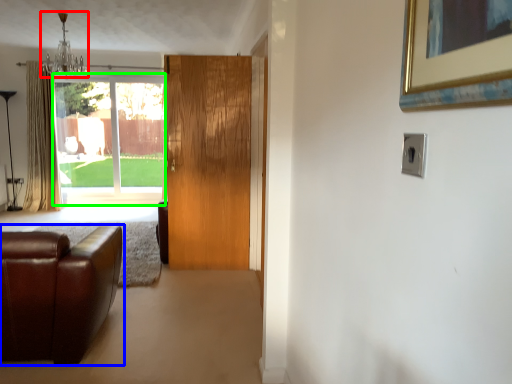
Question: Estimate the real-world distances between objects in this image. Which object is farther from light fixture (highlighted by a red box), studio couch (highlighted by a blue box) or window (highlighted by a green box)?

Choices:
 (A) studio couch
 (B) window

Answer: (A)